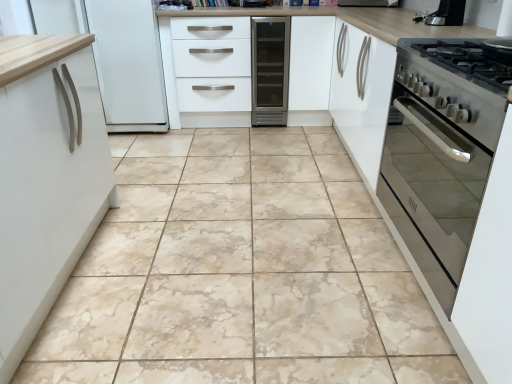
Question: From the image's perspective, relative to satin silver wine cooler at center, is satin black coffee machine at upper right above or below?

Choices:
 (A) above
 (B) below

Answer: (B)

Question: Is satin black coffee machine at upper right bigger or smaller than satin silver wine cooler at center?

Choices:
 (A) small
 (B) big

Answer: (A)

Question: Which object is positioned closest to the satin black coffee machine at upper right?

Choices:
 (A) stainless steel oven at right
 (B) satin silver wine cooler at center
 (C) marble tile at center
 (D) white matte drawer at center

Answer: (A)

Question: Estimate the real-world distances between objects in this image. Which object is closer to the marble tile at center?

Choices:
 (A) satin black coffee machine at upper right
 (B) stainless steel oven at right
 (C) satin silver wine cooler at center
 (D) white matte drawer at center

Answer: (B)